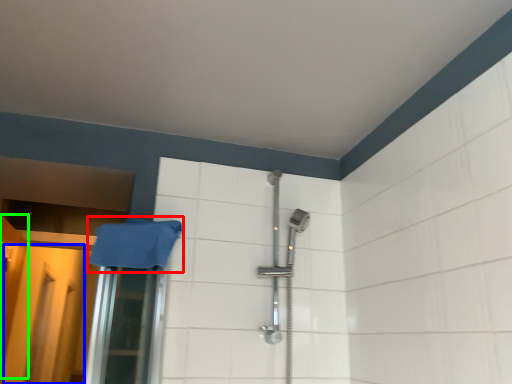
Question: Which object is positioned farthest from bath towel (highlighted by a red box)? Select from screen door (highlighted by a blue box) and door (highlighted by a green box).

Choices:
 (A) screen door
 (B) door

Answer: (B)